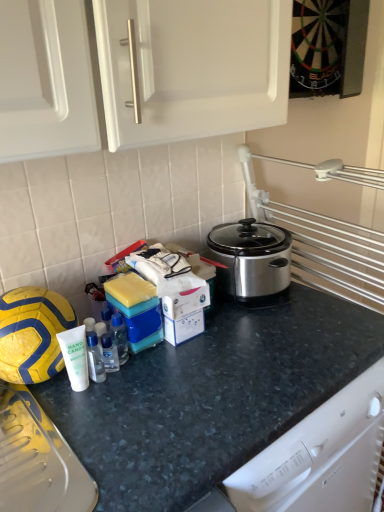
At what (x,y) coordinates should I click in order to perform the action: click on vacant area located to the right-hand side of yellow matte football at left. Please return your answer as a coordinate pair (x, y). The width and height of the screenshot is (384, 512). Looking at the image, I should click on (104, 400).